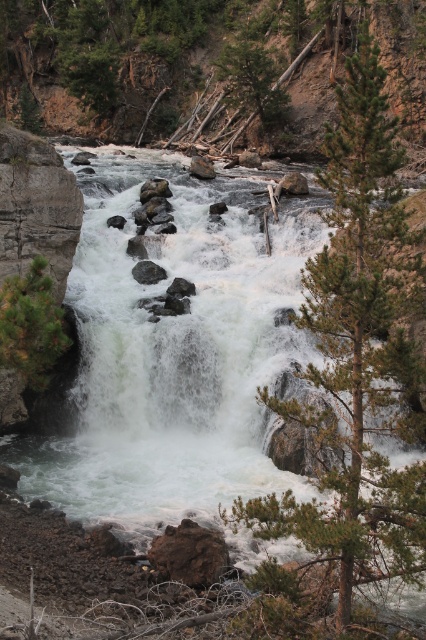
Question: Which point is farther to the camera?

Choices:
 (A) (48, 355)
 (B) (383, 260)

Answer: (A)

Question: Can you confirm if green needle-like tree at center-right is positioned to the right of green matte tree at left?

Choices:
 (A) no
 (B) yes

Answer: (B)

Question: Estimate the real-world distances between objects in this image. Which object is closer to the smooth gray rock at center?

Choices:
 (A) gray smooth rock at center
 (B) green matte tree at left
 (C) green needle-like tree at center-right

Answer: (A)

Question: Which point appears farthest from the camera in this image?

Choices:
 (A) (204, 160)
 (B) (143, 278)
 (C) (311, 316)
 (D) (16, 292)

Answer: (A)

Question: Does green matte tree at left appear under gray smooth rock at center?

Choices:
 (A) yes
 (B) no

Answer: (A)

Question: Is green matte tree at left thinner than gray smooth rock at center?

Choices:
 (A) yes
 (B) no

Answer: (B)